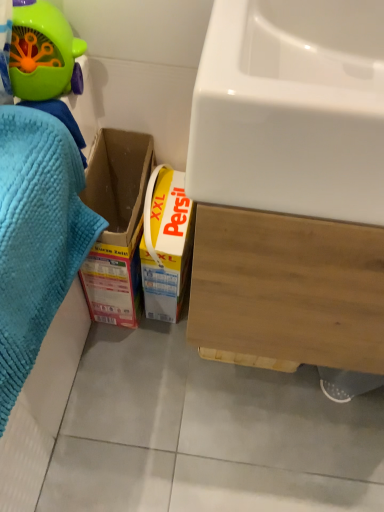
What are the coordinates of `white glossy sink at upper right` in the screenshot? It's located at [x=291, y=109].

Based on the photo, in terms of size, does white glossy sink at upper right appear bigger or smaller than green plastic toy at upper left?

Considering their sizes, white glossy sink at upper right takes up more space than green plastic toy at upper left.

Is white glossy sink at upper right positioned with its back to green plastic toy at upper left?

white glossy sink at upper right does not have its back to green plastic toy at upper left.

From the image's perspective, between white glossy sink at upper right and green plastic toy at upper left, which one is located above?

green plastic toy at upper left, from the image's perspective.

Does white glossy sink at upper right appear on the left side of green plastic toy at upper left?

Incorrect, white glossy sink at upper right is not on the left side of green plastic toy at upper left.

Considering the relative sizes of green plastic toy at upper left and blue textured towel at left in the image provided, is green plastic toy at upper left bigger than blue textured towel at left?

Incorrect, green plastic toy at upper left is not larger than blue textured towel at left.

Are green plastic toy at upper left and blue textured towel at left located far from each other?

No.

Does point (38, 10) lie in front of point (18, 373)?

No, it is behind (18, 373).

Identify the location of sink in front of the blue textured towel at left. (291, 109).

Does blue textured towel at left have a greater width compared to white glossy sink at upper right?

No.

Is white glossy sink at upper right surrounded by blue textured towel at left?

Actually, white glossy sink at upper right is outside blue textured towel at left.

How different are the orientations of white glossy sink at upper right and blue textured towel at left in degrees?

white glossy sink at upper right and blue textured towel at left are facing 89.9 degrees away from each other.

Is white glossy sink at upper right outside of blue textured towel at left?

Yes, white glossy sink at upper right is outside of blue textured towel at left.

Considering the sizes of white glossy sink at upper right and blue textured towel at left in the image, is white glossy sink at upper right bigger or smaller than blue textured towel at left?

In the image, white glossy sink at upper right appears to be smaller than blue textured towel at left.

Locate an element on the screen. The image size is (384, 512). sink that appears in front of the blue textured towel at left is located at coordinates (291, 109).

Do you think green plastic toy at upper left is within white glossy sink at upper right, or outside of it?

green plastic toy at upper left cannot be found inside white glossy sink at upper right.

Image resolution: width=384 pixels, height=512 pixels. I want to click on sink below the green plastic toy at upper left (from the image's perspective), so click(291, 109).

Is blue textured towel at left far from green plastic toy at upper left?

No, blue textured towel at left is in close proximity to green plastic toy at upper left.

Considering the sizes of blue textured towel at left and green plastic toy at upper left in the image, is blue textured towel at left taller or shorter than green plastic toy at upper left?

In the image, blue textured towel at left appears to be taller than green plastic toy at upper left.

Can you confirm if blue textured towel at left is wider than green plastic toy at upper left?

Yes.

At what (x,y) coordinates should I click in order to perform the action: click on sink on the right of the green plastic toy at upper left. Please return your answer as a coordinate pair (x, y). The width and height of the screenshot is (384, 512). Looking at the image, I should click on pos(291,109).

In order to click on bath towel that appears in front of the green plastic toy at upper left in this screenshot , I will do `click(37, 232)`.

Considering their positions, is green plastic toy at upper left positioned closer to blue textured towel at left than white glossy sink at upper right?

green plastic toy at upper left is positioned closer to the anchor blue textured towel at left.

Considering their positions, is blue textured towel at left positioned closer to green plastic toy at upper left than white glossy sink at upper right?

blue textured towel at left is closer to green plastic toy at upper left.

Looking at the image, which one is located closer to white glossy sink at upper right, blue textured towel at left or green plastic toy at upper left?

blue textured towel at left lies closer to white glossy sink at upper right than the other object.

Based on the photo, looking at the image, which one is located further to blue textured towel at left, white glossy sink at upper right or green plastic toy at upper left?

white glossy sink at upper right is further to blue textured towel at left.

Based on their spatial positions, is green plastic toy at upper left or blue textured towel at left further from white glossy sink at upper right?

green plastic toy at upper left is further to white glossy sink at upper right.

Estimate the real-world distances between objects in this image. Which object is closer to green plastic toy at upper left, white glossy sink at upper right or blue textured towel at left?

Based on the image, blue textured towel at left appears to be nearer to green plastic toy at upper left.

The height and width of the screenshot is (512, 384). In order to click on toy situated between blue textured towel at left and white glossy sink at upper right from left to right in this screenshot , I will do `click(43, 52)`.